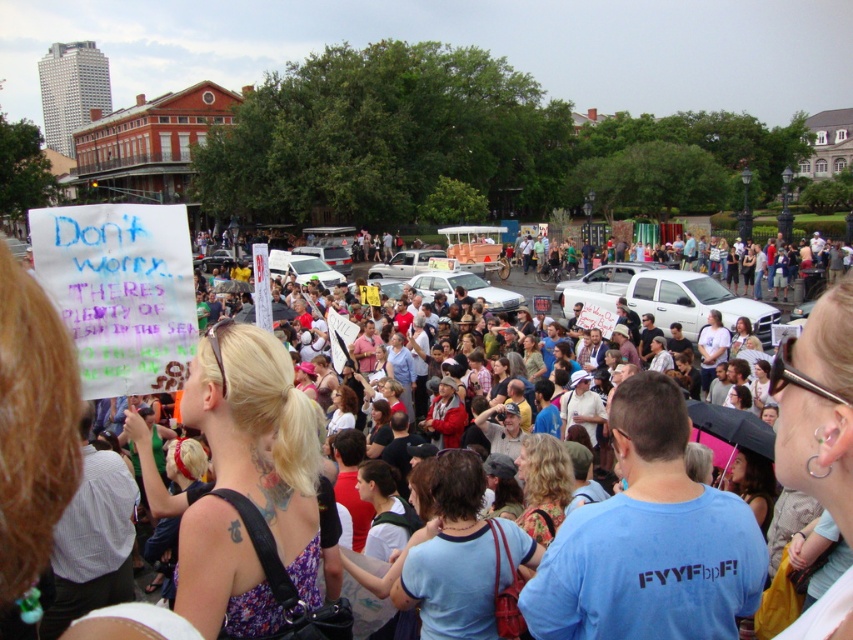
Question: Does multicolored fabric crowd at center lie behind floral fabric dress at center?

Choices:
 (A) no
 (B) yes

Answer: (A)

Question: Can you confirm if multicolored fabric crowd at center is positioned above matte black tank top at center?

Choices:
 (A) no
 (B) yes

Answer: (B)

Question: Which point is closer to the camera?

Choices:
 (A) blue cotton shirt at center
 (B) floral dress at center
 (C) matte black umbrella at lower right
 (D) multicolored fabric crowd at center

Answer: (D)

Question: Which point is closer to the camera taking this photo?

Choices:
 (A) (560, 476)
 (B) (479, 614)
 (C) (277, 404)

Answer: (C)

Question: Which point is closer to the camera?

Choices:
 (A) floral fabric dress at center
 (B) matte black tank top at center
 (C) multicolored fabric crowd at center

Answer: (C)

Question: Is floral dress at center further to the viewer compared to floral fabric dress at center?

Choices:
 (A) no
 (B) yes

Answer: (A)